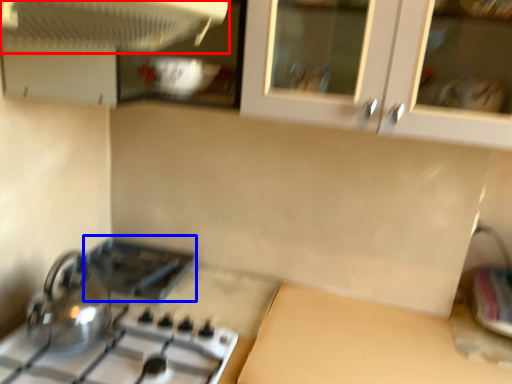
Question: Which of the following is the farthest to the observer, kitchen appliance (highlighted by a red box) or appliance (highlighted by a blue box)?

Choices:
 (A) kitchen appliance
 (B) appliance

Answer: (B)